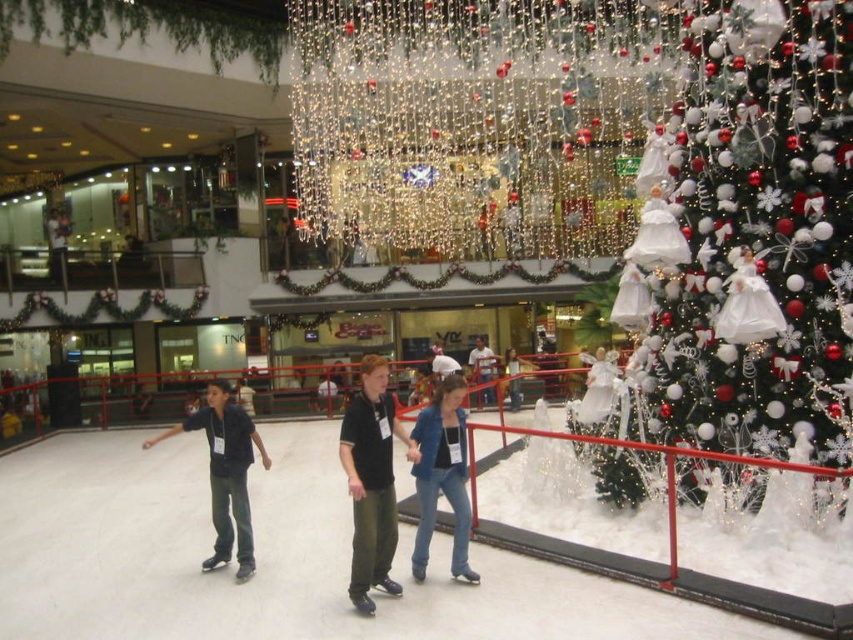
You are standing at the center of the ice rink wearing dark blue jeans at center. You want to skate towards the white glittering tree at upper right. Which direction should you move to reach it?

The white glittering tree at upper right is to the right of dark blue jeans at center. So you should move to your right to reach the white glittering tree at upper right.

From the picture: You are a photographer standing at the lower center of the ice rink. You want to take a photo of the white glittering tree at upper right while also including the blue denim jeans at lower center in the frame. Which object should you focus on first to ensure both are in the shot?

The white glittering tree at upper right is larger than the blue denim jeans at lower center, so you should focus on the white glittering tree at upper right first to ensure both fit in the frame.

You are standing at the entrance of the ice skating rink and see two people skating in the center. One is wearing dark blue jeans at center and the other is wearing matte black jacket at center. From your perspective, which skater is on the left side?

The dark blue jeans at center is to the left of matte black jacket at center.